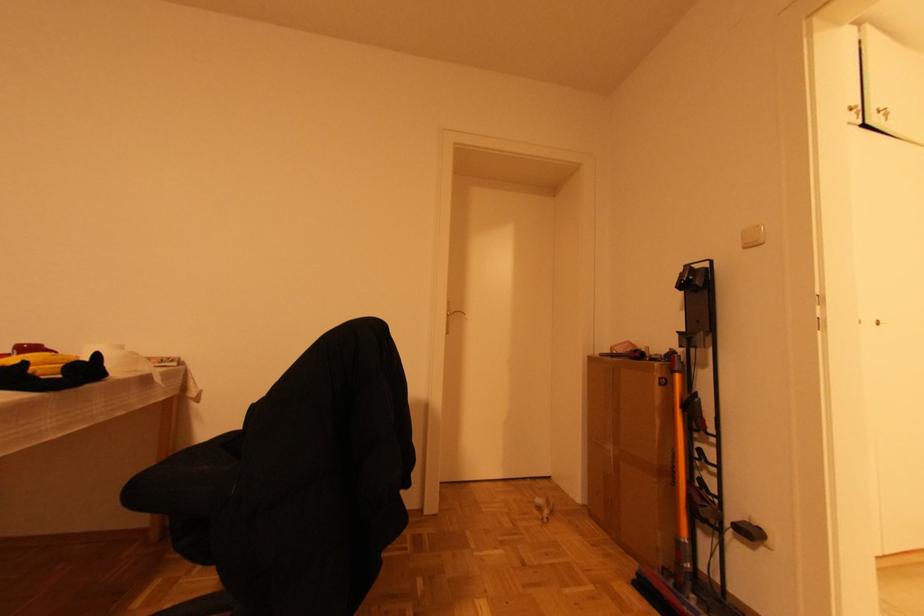
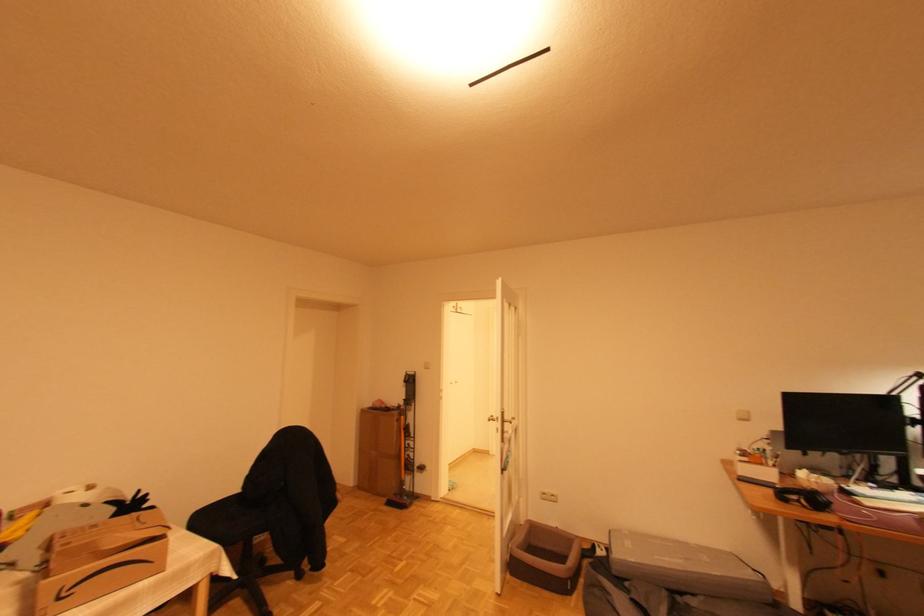
Locate, in the second image, the point that corresponds to point 675,354 in the first image.

(402, 407)